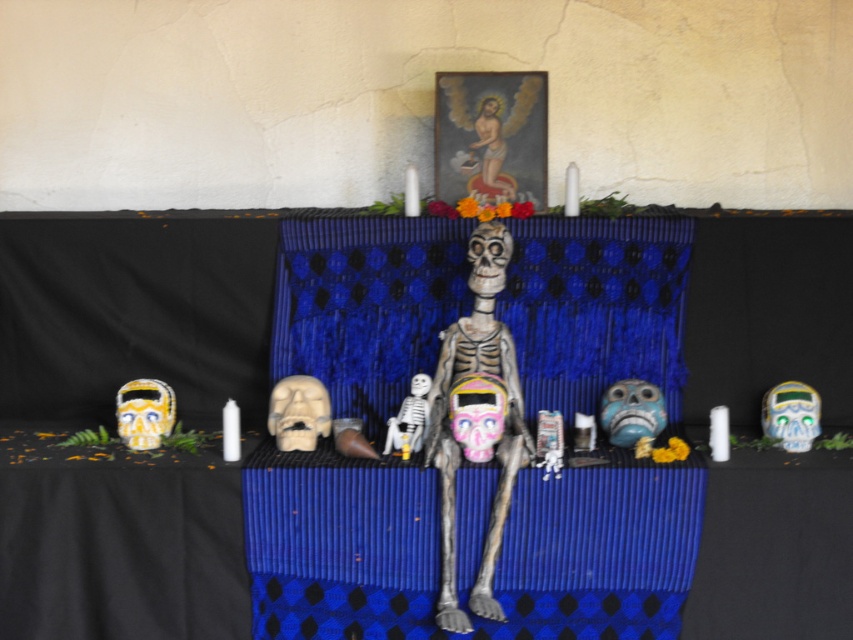
You are standing in front of the altar and want to place a small offering between the golden beaded skull at left and the smooth wooden figure at upper center. Which object should you place it closer to if you want the offering to be nearer to the viewer?

You should place the offering closer to the golden beaded skull at left because it is nearer to the viewer compared to the smooth wooden figure at upper center.

You are standing in front of the altar and want to place a small offering exactly at the center of the altar. The altar has a coordinate system where the bottom left corner is the origin point. The smooth wooden figure at upper center is located at point 0.239, 0.577. Where should you place the offering to be at the exact center of the altar?

The exact center of the altar would be at point (426,320). Since the smooth wooden figure at upper center is at (491,152), you should move slightly to the right and down from its position to reach the center at (426,320).

You are setting up a traditional altar and need to arrange the smooth wooden figure at upper center and the white matte skeleton at center. According to the scene description, which object is taller?

The smooth wooden figure at upper center is taller than the white matte skeleton at center.